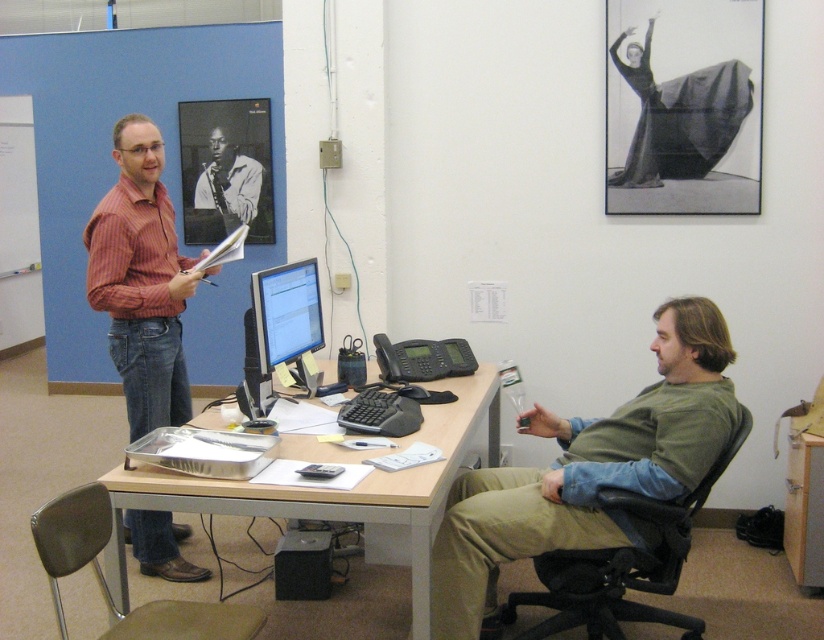
Is black plastic chair at right shorter than black and white photograph of man playing saxophone at upper left?

In fact, black plastic chair at right may be taller than black and white photograph of man playing saxophone at upper left.

Between black plastic chair at right and black and white photograph of man playing saxophone at upper left, which one is positioned lower?

Positioned lower is black plastic chair at right.

Identify the location of black plastic chair at right. (621, 564).

Looking at this image, can you confirm if reddish-brown striped shirt at left is positioned below matte black monitor at center?

Incorrect, reddish-brown striped shirt at left is not positioned below matte black monitor at center.

This screenshot has height=640, width=824. Describe the element at coordinates (141, 280) in the screenshot. I see `reddish-brown striped shirt at left` at that location.

Is point (162, 216) in front of point (263, 307)?

No, (162, 216) is further to viewer.

Where is `reddish-brown striped shirt at left`? This screenshot has width=824, height=640. reddish-brown striped shirt at left is located at coordinates (141, 280).

Who is shorter, wooden desk at center or black plastic chair at right?

wooden desk at center

This screenshot has height=640, width=824. I want to click on wooden desk at center, so click(350, 490).

This screenshot has height=640, width=824. In order to click on wooden desk at center in this screenshot , I will do `click(350, 490)`.